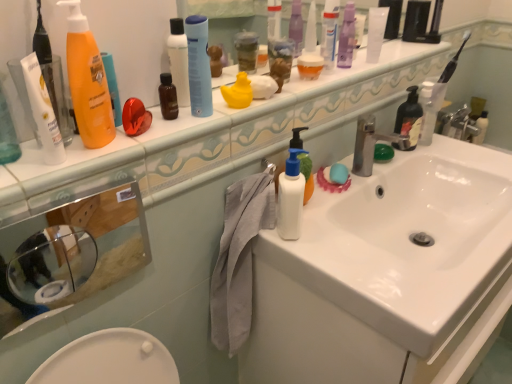
At what (x,y) coordinates should I click in order to perform the action: click on vacant region in front of blue matte spray can at upper center, which is counted as the 2th cleaning product, starting from the right. Please return your answer as a coordinate pair (x, y). The image size is (512, 384). Looking at the image, I should click on (165, 142).